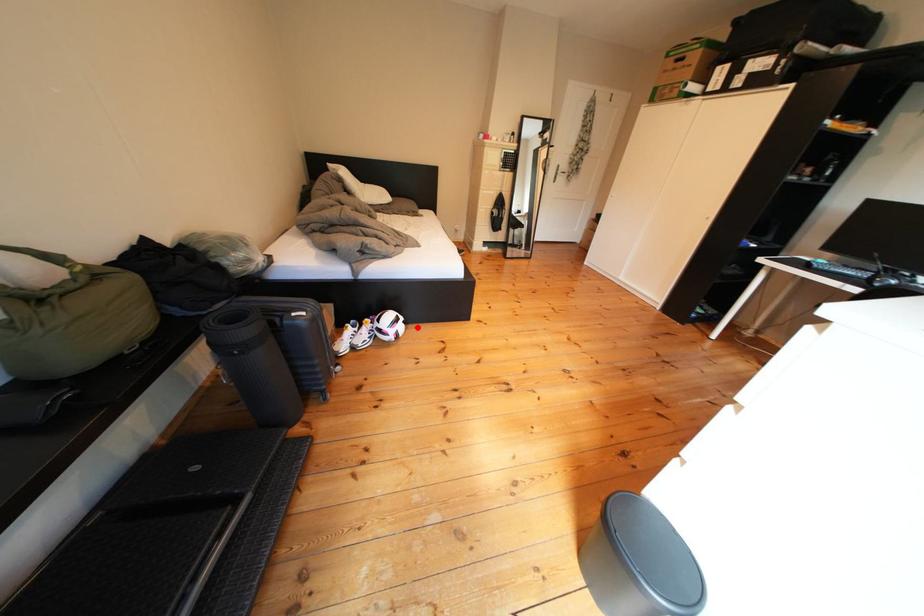
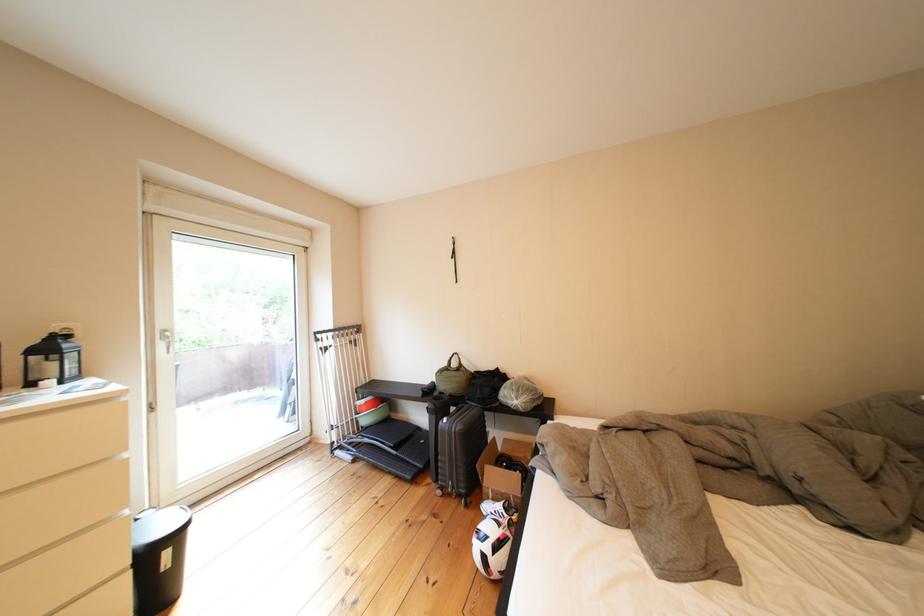
Where in the second image is the point corresponding to the highlighted location from the first image?

(499, 562)